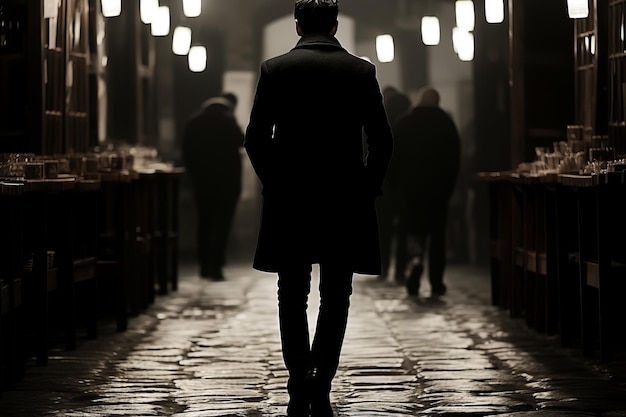
Find the location of a particular element. windows is located at coordinates (576, 71), (86, 65).